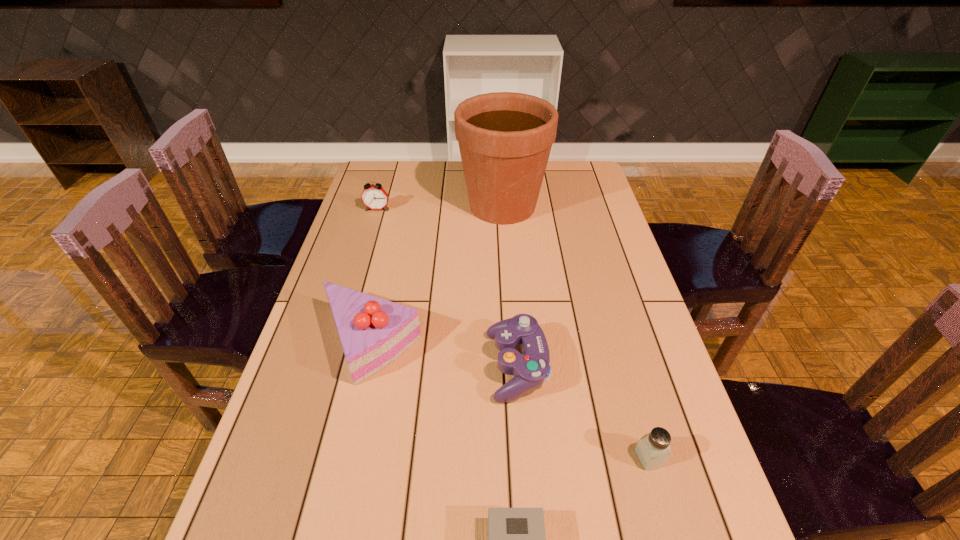
Locate an element on the screen. flowerpot is located at coordinates (505, 138).

At what (x,y) coordinates should I click in order to perform the action: click on the second tallest object. Please return your answer as a coordinate pair (x, y). Image resolution: width=960 pixels, height=540 pixels. Looking at the image, I should click on (374, 332).

Where is `the left alarm clock`? The height and width of the screenshot is (540, 960). the left alarm clock is located at coordinates (374, 197).

Identify the location of the taller alarm clock. (374, 197).

Where is `control`? control is located at coordinates (530, 369).

The image size is (960, 540). In order to click on the fifth farthest object in this screenshot , I will do `click(653, 449)`.

This screenshot has height=540, width=960. I want to click on saltshaker, so click(653, 449).

Where is `vacant space located on the right of the flowerpot`? This screenshot has width=960, height=540. vacant space located on the right of the flowerpot is located at coordinates (x=598, y=205).

Locate an element on the screen. free space located 0.350m on the right of the second tallest object is located at coordinates (559, 343).

In order to click on vacant space located on the clock face of the farther alarm clock in this screenshot , I will do `click(355, 283)`.